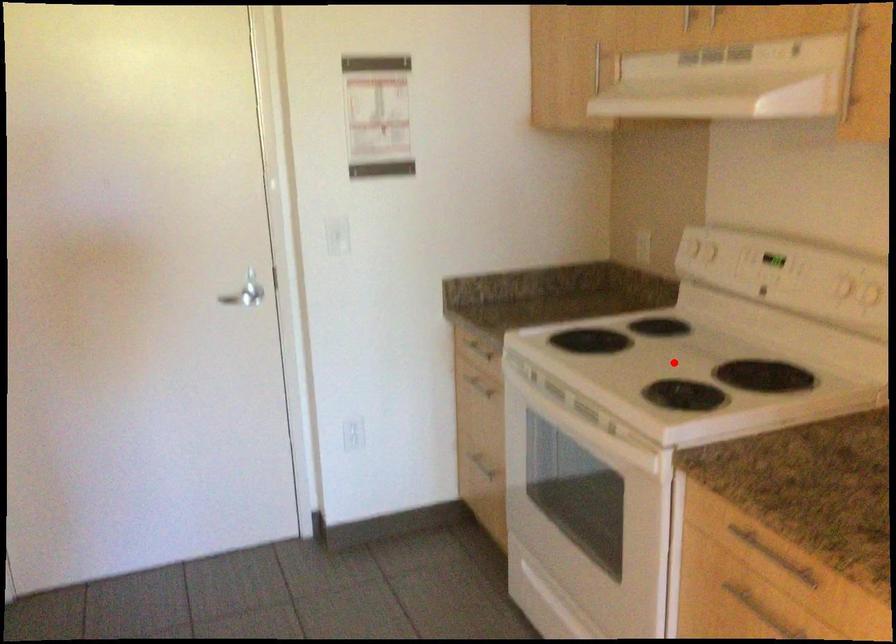
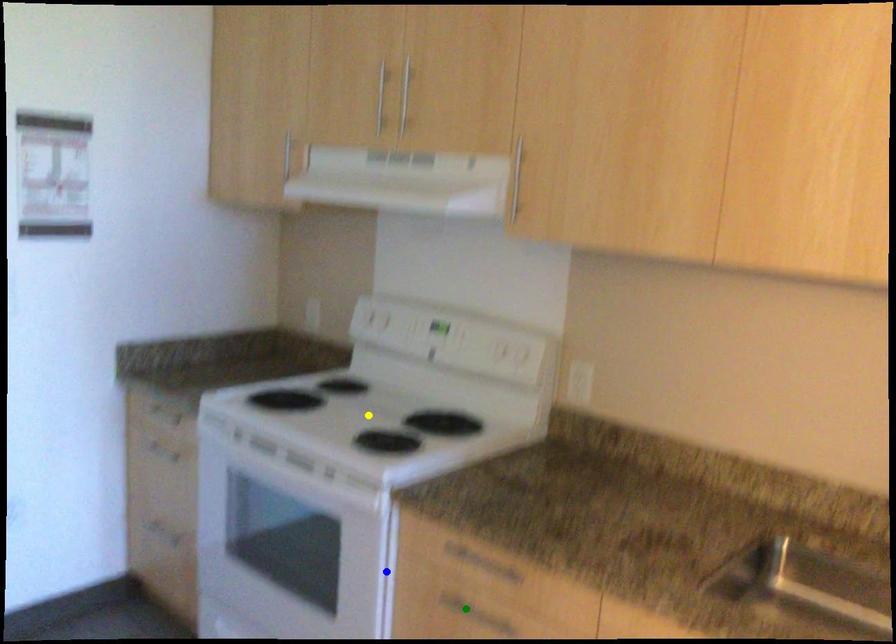
Question: I am providing you with two images of the same scene from different viewpoints. A red point is marked on the first image. You are given multiple points on the second image. In image 2, which mark is for the same physical point as the one in image 1?

Choices:
 (A) yellow point
 (B) green point
 (C) blue point

Answer: (A)